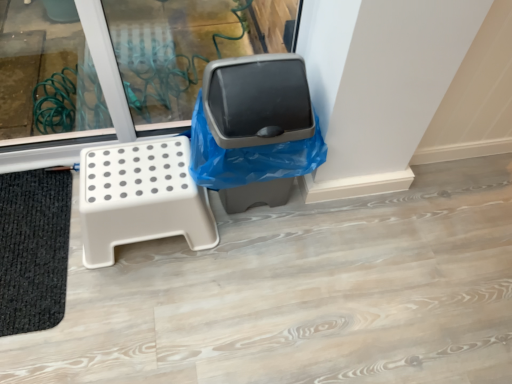
The width and height of the screenshot is (512, 384). What do you see at coordinates (141, 198) in the screenshot? I see `white plastic stool at left` at bounding box center [141, 198].

Describe the element at coordinates (257, 101) in the screenshot. I see `matte plastic trash can at center` at that location.

You are a GUI agent. You are given a task and a screenshot of the screen. Output one action in this format:
    pyautogui.click(x=<x>, y=<y>)
    Task: Click on the black textured bath mat at lower left
    The width and height of the screenshot is (512, 384).
    Given the screenshot: What is the action you would take?
    pyautogui.click(x=33, y=249)

I want to click on white plastic stool at left, so click(x=141, y=198).

Is black textured bath mat at lower left positioned far away from matte plastic trash can at center?

They are positioned close to each other.

Considering the relative sizes of black textured bath mat at lower left and matte plastic trash can at center in the image provided, is black textured bath mat at lower left wider than matte plastic trash can at center?

No.

From the image's perspective, between black textured bath mat at lower left and matte plastic trash can at center, who is located below?

From the image's view, black textured bath mat at lower left is below.

How far apart are matte plastic trash can at center and black textured bath mat at lower left?

matte plastic trash can at center is 68.22 centimeters away from black textured bath mat at lower left.

Is matte plastic trash can at center smaller than black textured bath mat at lower left?

Actually, matte plastic trash can at center might be larger than black textured bath mat at lower left.

Is matte plastic trash can at center oriented towards black textured bath mat at lower left?

No, matte plastic trash can at center does not turn towards black textured bath mat at lower left.

The image size is (512, 384). Find the location of `bath mat behind the matte plastic trash can at center`. bath mat behind the matte plastic trash can at center is located at coordinates (33, 249).

Who is smaller, white plastic stool at left or matte plastic trash can at center?

white plastic stool at left.

From a real-world perspective, which object stands above the other?

From a 3D spatial view, matte plastic trash can at center is above.

Considering the sizes of objects white plastic stool at left and matte plastic trash can at center in the image provided, who is taller, white plastic stool at left or matte plastic trash can at center?

matte plastic trash can at center.

From the image's perspective, relative to matte plastic trash can at center, is white plastic stool at left above or below?

Clearly, from the image's perspective, white plastic stool at left is below matte plastic trash can at center.

Considering the relative sizes of matte plastic trash can at center and white plastic stool at left in the image provided, is matte plastic trash can at center shorter than white plastic stool at left?

In fact, matte plastic trash can at center may be taller than white plastic stool at left.

From the image's perspective, does matte plastic trash can at center appear higher than white plastic stool at left?

Yes.

Is black textured bath mat at lower left positioned beyond the bounds of white plastic stool at left?

black textured bath mat at lower left is positioned outside white plastic stool at left.

Considering the positions of points (65, 210) and (212, 239), is point (65, 210) closer to camera compared to point (212, 239)?

No, it is behind (212, 239).

You are a GUI agent. You are given a task and a screenshot of the screen. Output one action in this format:
    pyautogui.click(x=<x>, y=<y>)
    Task: Click on the bath mat behind the white plastic stool at left
    This screenshot has height=384, width=512.
    Given the screenshot: What is the action you would take?
    33,249

At what (x,y) coordinates should I click in order to perform the action: click on bath mat located on the left of white plastic stool at left. Please return your answer as a coordinate pair (x, y). Looking at the image, I should click on (33, 249).

Between white plastic stool at left and black textured bath mat at lower left, which one appears on the left side from the viewer's perspective?

Positioned to the left is black textured bath mat at lower left.

In the image, is white plastic stool at left positioned in front of or behind black textured bath mat at lower left?

white plastic stool at left is in front of black textured bath mat at lower left.

Choose the correct answer: Is white plastic stool at left inside black textured bath mat at lower left or outside it?

white plastic stool at left lies outside black textured bath mat at lower left.

Where is `garbage on the right side of black textured bath mat at lower left`? The width and height of the screenshot is (512, 384). garbage on the right side of black textured bath mat at lower left is located at coordinates (257, 101).

Locate an element on the screen. This screenshot has width=512, height=384. bath mat located underneath the matte plastic trash can at center (from a real-world perspective) is located at coordinates (33, 249).

Considering their positions, is matte plastic trash can at center positioned further to white plastic stool at left than black textured bath mat at lower left?

The object further to white plastic stool at left is black textured bath mat at lower left.

Looking at this image, from the image, which object appears to be farther from white plastic stool at left, black textured bath mat at lower left or matte plastic trash can at center?

Based on the image, black textured bath mat at lower left appears to be further to white plastic stool at left.

Estimate the real-world distances between objects in this image. Which object is further from matte plastic trash can at center, black textured bath mat at lower left or white plastic stool at left?

black textured bath mat at lower left is further to matte plastic trash can at center.

Looking at the image, which one is located further to black textured bath mat at lower left, matte plastic trash can at center or white plastic stool at left?

matte plastic trash can at center is positioned further to the anchor black textured bath mat at lower left.

Which object lies further to the anchor point black textured bath mat at lower left, white plastic stool at left or matte plastic trash can at center?

matte plastic trash can at center lies further to black textured bath mat at lower left than the other object.

Looking at the image, which one is located further to matte plastic trash can at center, white plastic stool at left or black textured bath mat at lower left?

black textured bath mat at lower left.

At what (x,y) coordinates should I click in order to perform the action: click on furniture located between black textured bath mat at lower left and matte plastic trash can at center in the left-right direction. Please return your answer as a coordinate pair (x, y). The width and height of the screenshot is (512, 384). Looking at the image, I should click on (141, 198).